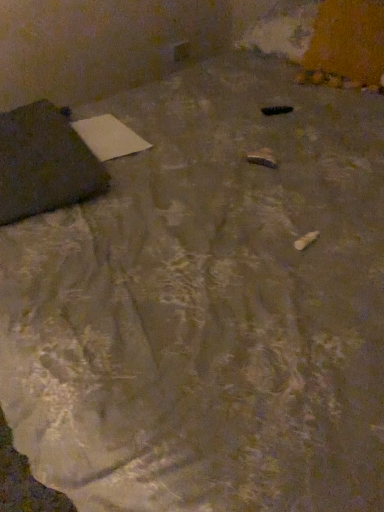
What is the approximate width of matte black bag at left?

matte black bag at left is 27.27 centimeters wide.

Describe the element at coordinates (44, 163) in the screenshot. This screenshot has height=512, width=384. I see `matte black bag at left` at that location.

The height and width of the screenshot is (512, 384). I want to click on matte black bag at left, so click(44, 163).

In order to face matte black bag at left, should I rotate leftwards or rightwards?

Rotate left and turn 20.923 degrees.

Measure the distance between point (103, 128) and camera.

The depth of point (103, 128) is 1.33 meters.

What do you see at coordinates (109, 137) in the screenshot? Image resolution: width=384 pixels, height=512 pixels. I see `white paper at upper left` at bounding box center [109, 137].

Locate an element on the screen. white paper at upper left is located at coordinates (109, 137).

Find the location of a particular element. matte black bag at left is located at coordinates (44, 163).

Visually, is white paper at upper left positioned to the left or to the right of matte black bag at left?

From the image, it's evident that white paper at upper left is to the right of matte black bag at left.

Relative to matte black bag at left, is white paper at upper left in front or behind?

In the image, white paper at upper left appears behind matte black bag at left.

Which point is more distant from viewer, (132,131) or (103,187)?

The point (132,131) is more distant.

From the image's perspective, which is above, white paper at upper left or matte black bag at left?

white paper at upper left is shown above in the image.

From a real-world perspective, relative to matte black bag at left, is white paper at upper left vertically above or below?

white paper at upper left is below matte black bag at left.

In terms of width, does white paper at upper left look wider or thinner when compared to matte black bag at left?

In the image, white paper at upper left appears to be more narrow than matte black bag at left.

From their relative heights in the image, would you say white paper at upper left is taller or shorter than matte black bag at left?

Clearly, white paper at upper left is shorter compared to matte black bag at left.

In terms of size, does white paper at upper left appear bigger or smaller than matte black bag at left?

white paper at upper left is smaller than matte black bag at left.

Is white paper at upper left situated inside matte black bag at left or outside?

white paper at upper left is spatially situated outside matte black bag at left.

Would you say white paper at upper left is a long distance from matte black bag at left?

Actually, white paper at upper left and matte black bag at left are a little close together.

Is matte black bag at left at the back of white paper at upper left?

No, white paper at upper left's orientation is not away from matte black bag at left.

What's the angular difference between white paper at upper left and matte black bag at left's facing directions?

They differ by 1.18 degrees in their facing directions.

In the scene shown: How much distance is there between white paper at upper left and matte black bag at left?

A distance of 5.82 inches exists between white paper at upper left and matte black bag at left.

Find the location of a particular element. This screenshot has width=384, height=512. notepad below the matte black bag at left (from a real-world perspective) is located at coordinates (109, 137).

Based on their positions, is matte black bag at left located to the left or right of white paper at upper left?

Based on their positions, matte black bag at left is located to the left of white paper at upper left.

Relative to white paper at upper left, is matte black bag at left in front or behind?

matte black bag at left is in front of white paper at upper left.

Is point (31, 197) farther from viewer compared to point (92, 148)?

That is False.

From the image's perspective, is matte black bag at left positioned above or below white paper at upper left?

matte black bag at left is situated lower than white paper at upper left in the image.

Consider the image. From a real-world perspective, who is located lower, matte black bag at left or white paper at upper left?

white paper at upper left is physically lower.

Is matte black bag at left thinner than white paper at upper left?

No.

Who is taller, matte black bag at left or white paper at upper left?

matte black bag at left.

Between matte black bag at left and white paper at upper left, which one has smaller size?

Smaller between the two is white paper at upper left.

Is matte black bag at left positioned beyond the bounds of white paper at upper left?

matte black bag at left is positioned outside white paper at upper left.

Is matte black bag at left positioned far away from white paper at upper left?

No, matte black bag at left is not far away from white paper at upper left.

Is matte black bag at left looking in the opposite direction of white paper at upper left?

Yes, white paper at upper left is at the back of matte black bag at left.

How different are the orientations of matte black bag at left and white paper at upper left in degrees?

1.18 degrees separate the facing orientations of matte black bag at left and white paper at upper left.

Identify the location of furniture in front of the white paper at upper left. (44, 163).

The height and width of the screenshot is (512, 384). In the image, there is a white paper at upper left. In order to click on furniture below it (from the image's perspective) in this screenshot , I will do `click(44, 163)`.

Locate an element on the screen. furniture lying on the left of white paper at upper left is located at coordinates pyautogui.click(x=44, y=163).